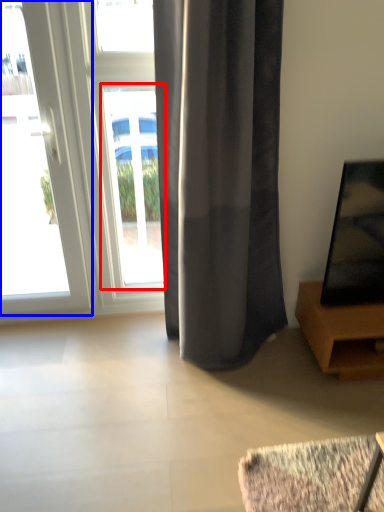
Question: Among these objects, which one is nearest to the camera, window (highlighted by a red box) or door (highlighted by a blue box)?

Choices:
 (A) window
 (B) door

Answer: (B)